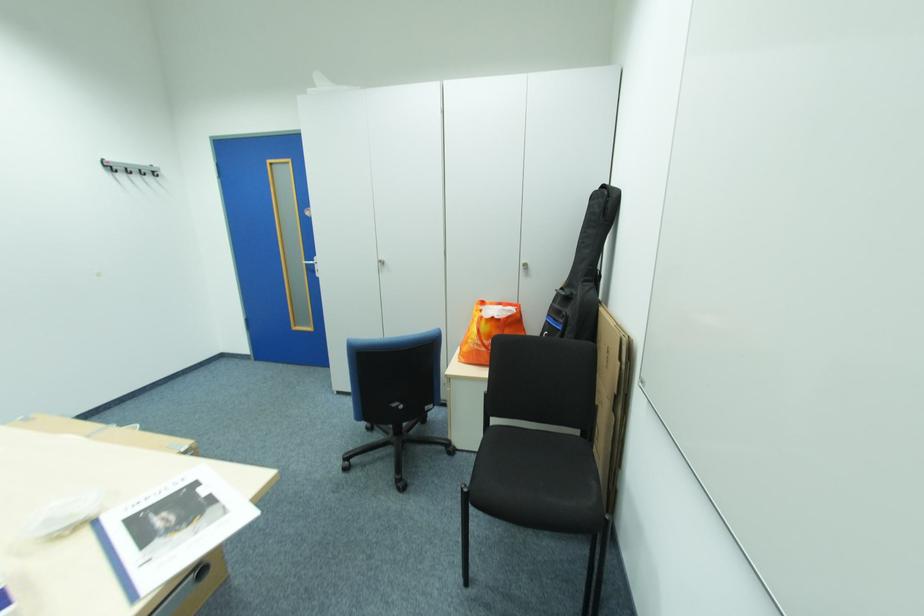
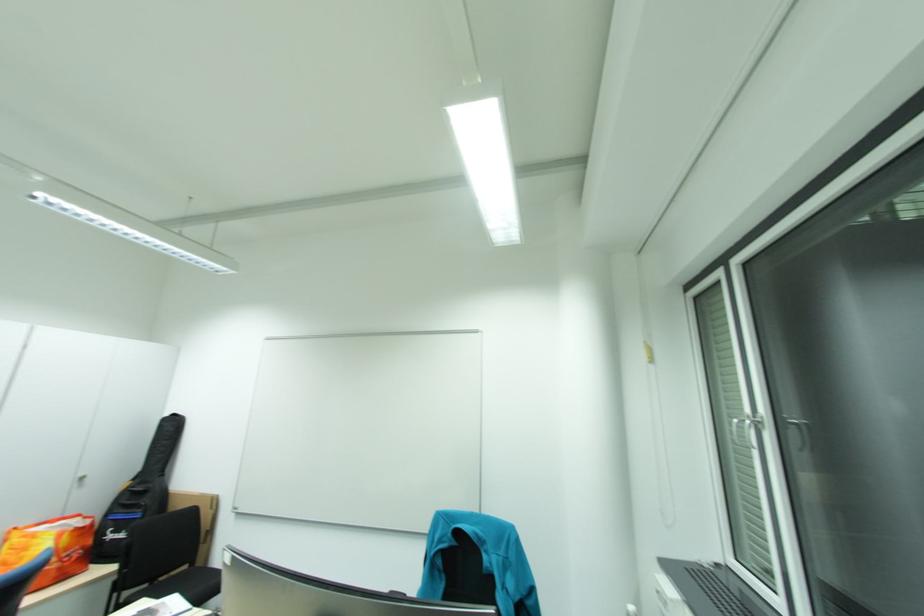
Locate, in the second image, the point that corresponds to the point at 586,431 in the first image.

(193, 568)